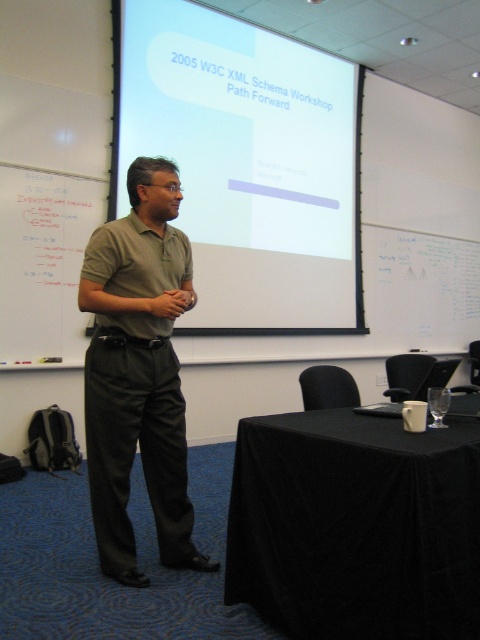
Question: Which object appears farthest from the camera in this image?

Choices:
 (A) white matte projection screen at upper center
 (B) whiteboard at left
 (C) black clothed table at lower right

Answer: (A)

Question: Does white matte projection screen at upper center have a lesser width compared to matte khaki polo shirt at center?

Choices:
 (A) no
 (B) yes

Answer: (A)

Question: Which point is farther to the camera?

Choices:
 (A) (248, 45)
 (B) (434, 488)

Answer: (A)

Question: Does white matte projection screen at upper center appear on the right side of matte khaki polo shirt at center?

Choices:
 (A) yes
 (B) no

Answer: (A)

Question: Is white matte projection screen at upper center smaller than matte khaki polo shirt at center?

Choices:
 (A) yes
 (B) no

Answer: (B)

Question: Among these objects, which one is nearest to the camera?

Choices:
 (A) whiteboard at left
 (B) black clothed table at lower right
 (C) white matte projection screen at upper center

Answer: (B)